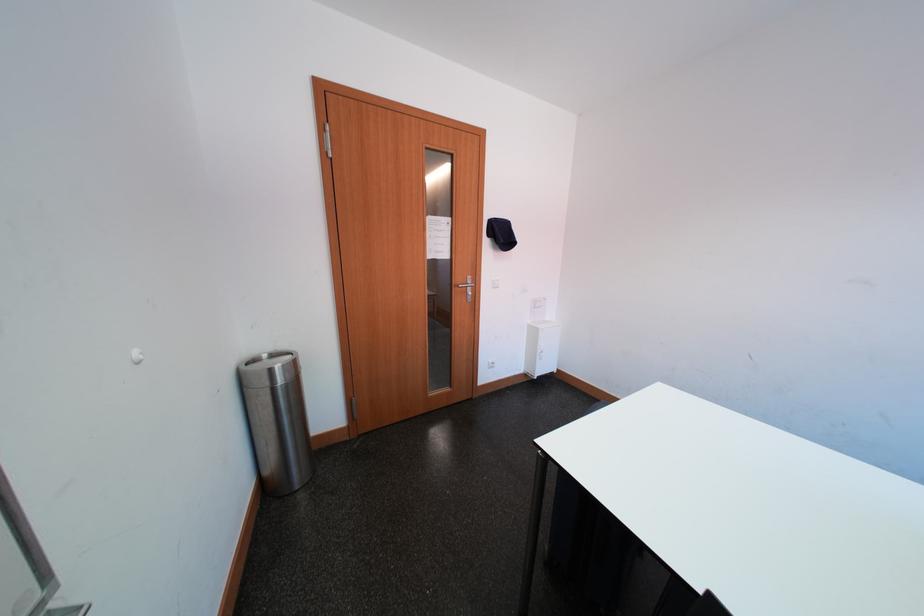
The height and width of the screenshot is (616, 924). I want to click on trash can lid, so click(x=269, y=369).